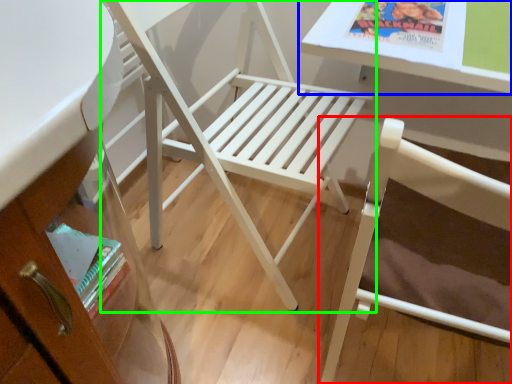
Question: Based on their relative distances, which object is farther from chair (highlighted by a red box)? Choose from table (highlighted by a blue box) and chair (highlighted by a green box).

Choices:
 (A) table
 (B) chair

Answer: (B)